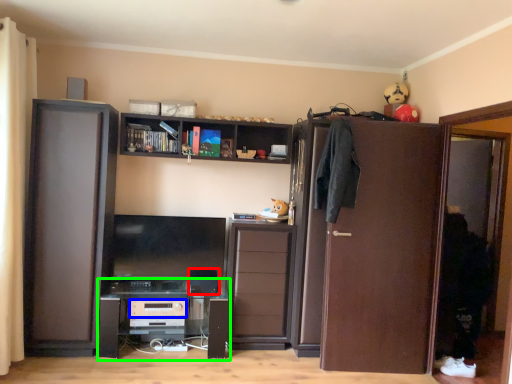
Question: Which object is positioned closest to appliance (highlighted by a red box)? Select from appliance (highlighted by a blue box) and computer desk (highlighted by a green box).

Choices:
 (A) appliance
 (B) computer desk

Answer: (A)